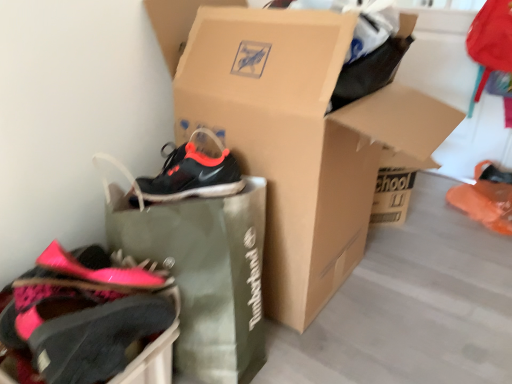
Question: From a real-world perspective, is orange matte shoe at lower right, marked as the second footwear in a left-to-right arrangement, physically above pink fabric shoe at lower left, which ranks as the first footwear in left-to-right order?

Choices:
 (A) yes
 (B) no

Answer: (B)

Question: From a real-world perspective, is orange matte shoe at lower right, marked as the second footwear in a left-to-right arrangement, below pink fabric shoe at lower left, which ranks as the first footwear in left-to-right order?

Choices:
 (A) no
 (B) yes

Answer: (B)

Question: Can you confirm if orange matte shoe at lower right, positioned as the 2th footwear in front-to-back order, is thinner than pink fabric shoe at lower left, placed as the 2th footwear when sorted from right to left?

Choices:
 (A) no
 (B) yes

Answer: (A)

Question: Can you confirm if orange matte shoe at lower right, marked as the second footwear in a left-to-right arrangement, is smaller than pink fabric shoe at lower left, which ranks as the first footwear in left-to-right order?

Choices:
 (A) yes
 (B) no

Answer: (A)

Question: Does orange matte shoe at lower right, which is the 1th footwear from back to front, have a lesser height compared to pink fabric shoe at lower left, which ranks as the first footwear in left-to-right order?

Choices:
 (A) yes
 (B) no

Answer: (A)

Question: Is the depth of orange matte shoe at lower right, which is the 1th footwear from back to front, less than that of pink fabric shoe at lower left, which ranks as the first footwear in left-to-right order?

Choices:
 (A) yes
 (B) no

Answer: (B)

Question: Does green fabric shopping bag at center have a greater width compared to cardboard shoebox at center?

Choices:
 (A) no
 (B) yes

Answer: (A)

Question: From a real-world perspective, is green fabric shopping bag at center beneath cardboard shoebox at center?

Choices:
 (A) yes
 (B) no

Answer: (A)

Question: Does green fabric shopping bag at center appear on the left side of cardboard shoebox at center?

Choices:
 (A) no
 (B) yes

Answer: (B)

Question: Could you tell me if green fabric shopping bag at center is turned towards cardboard shoebox at center?

Choices:
 (A) yes
 (B) no

Answer: (B)

Question: Can you confirm if green fabric shopping bag at center is taller than cardboard shoebox at center?

Choices:
 (A) no
 (B) yes

Answer: (A)

Question: Is the depth of green fabric shopping bag at center greater than that of cardboard shoebox at center?

Choices:
 (A) no
 (B) yes

Answer: (A)

Question: From the image's perspective, is pink fabric shoe at lower left, which is the first footwear from front to back, below cardboard shoebox at center?

Choices:
 (A) yes
 (B) no

Answer: (A)